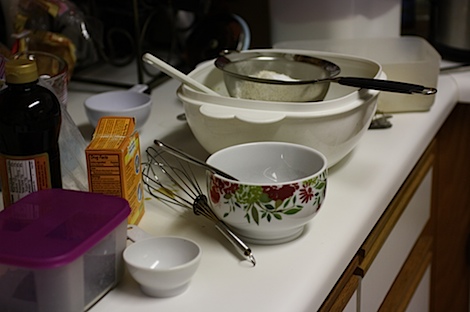
Locate an element on the screen. The height and width of the screenshot is (312, 470). drawer is located at coordinates tap(343, 296), tap(379, 250).